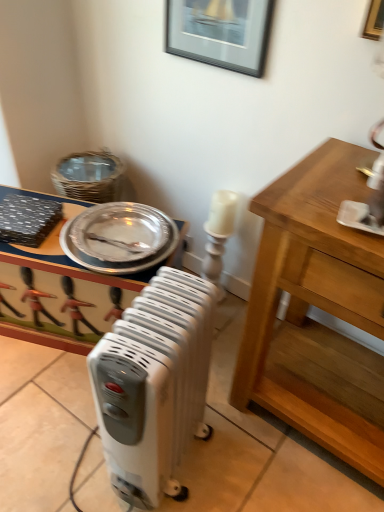
Where is `vacant space that is to the left of white plastic radiator at center`? This screenshot has width=384, height=512. vacant space that is to the left of white plastic radiator at center is located at coordinates (65, 450).